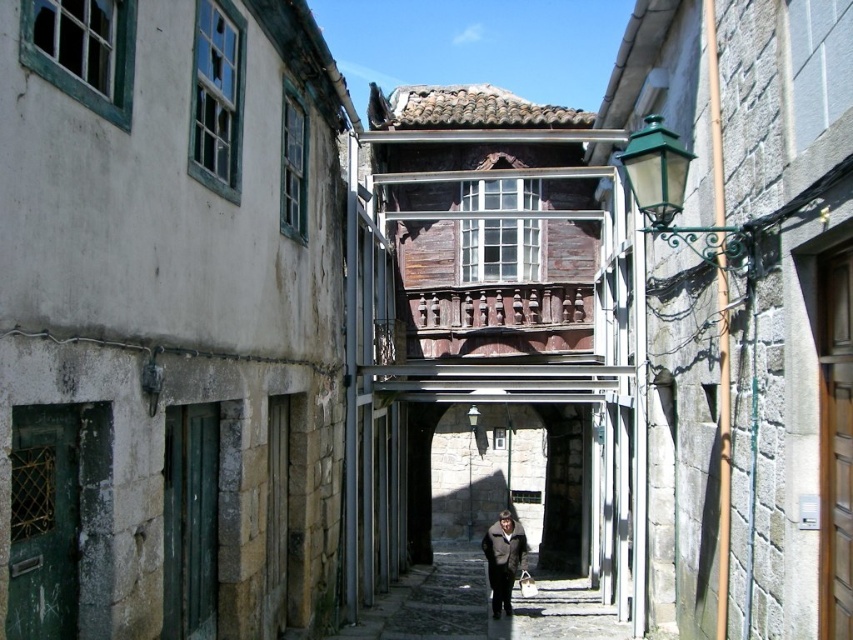
Does smooth stone path at center lie in front of dark brown leather coat at center?

Yes, it is.

From the picture: Can you confirm if smooth stone path at center is wider than dark brown leather coat at center?

Indeed, smooth stone path at center has a greater width compared to dark brown leather coat at center.

Is point (544, 618) positioned after point (488, 580)?

No, (544, 618) is in front of (488, 580).

Locate an element on the screen. This screenshot has height=640, width=853. smooth stone path at center is located at coordinates (480, 605).